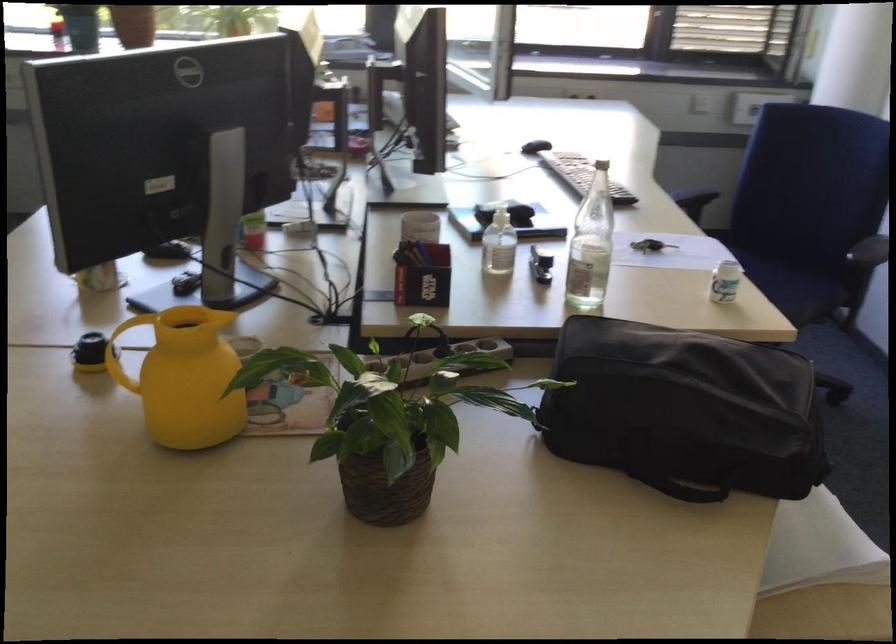
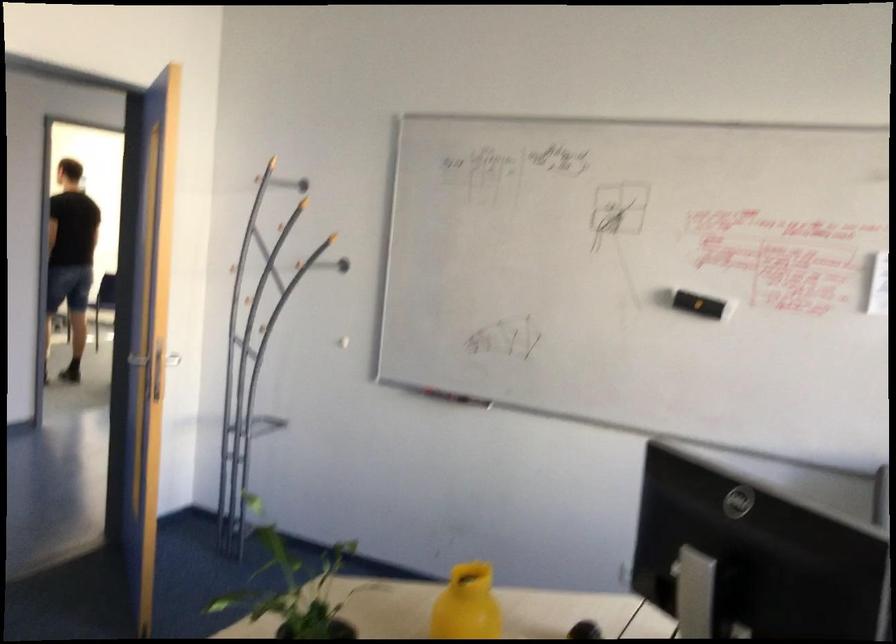
Find the pixel in the second image that matches point 117,373 in the first image.

(467, 605)